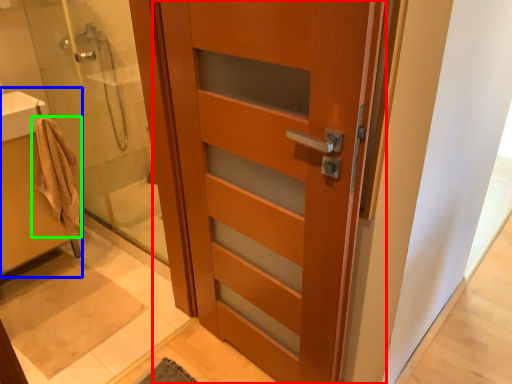
Question: Which object is the closest to the door (highlighted by a red box)? Choose among these: sink (highlighted by a blue box) or bathrobe (highlighted by a green box).

Choices:
 (A) sink
 (B) bathrobe

Answer: (B)